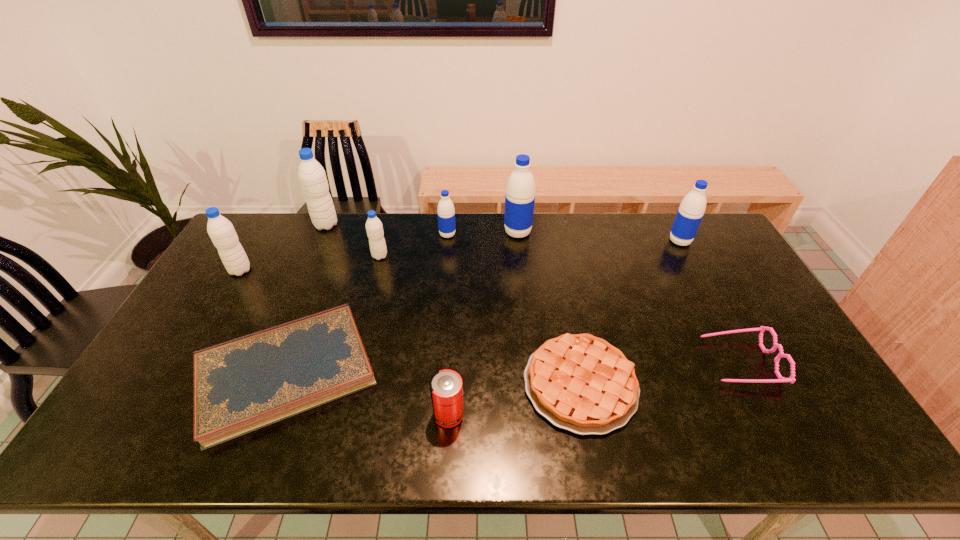
Identify the location of pie located at the near edge. (581, 383).

The width and height of the screenshot is (960, 540). Find the location of `paperback book that is at the near edge`. paperback book that is at the near edge is located at coordinates (244, 384).

Find the location of a particular element. The width and height of the screenshot is (960, 540). water bottle positioned at the left edge is located at coordinates (221, 231).

Identify the location of paperback book positioned at the left edge. Image resolution: width=960 pixels, height=540 pixels. (244, 384).

This screenshot has height=540, width=960. What are the coordinates of `water bottle at the right edge` in the screenshot? It's located at (691, 211).

At what (x,y) coordinates should I click in order to perform the action: click on spectacles that is positioned at the right edge. Please return your answer as a coordinate pair (x, y). Looking at the image, I should click on (791, 379).

Where is `object that is at the near left corner`? The height and width of the screenshot is (540, 960). object that is at the near left corner is located at coordinates tap(244, 384).

At what (x,y) coordinates should I click in order to perform the action: click on object present at the far right corner. Please return your answer as a coordinate pair (x, y). The height and width of the screenshot is (540, 960). Looking at the image, I should click on (691, 211).

This screenshot has height=540, width=960. In the image, there is a desktop. Identify the location of vacant space at the far edge. (570, 230).

In order to click on vacant space at the near edge of the desktop in this screenshot , I will do `click(737, 447)`.